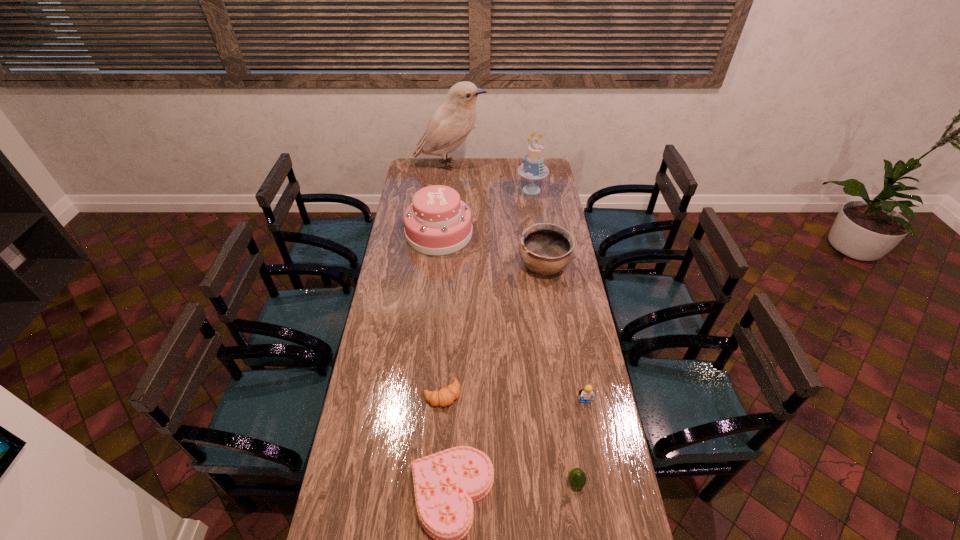
The width and height of the screenshot is (960, 540). What are the coordinates of `cake that is at the right edge` in the screenshot? It's located at (533, 168).

Find the location of a particular element. Image resolution: width=960 pixels, height=540 pixels. pottery that is at the right edge is located at coordinates (545, 249).

Identify the location of Lego present at the right edge. This screenshot has width=960, height=540. (587, 393).

Where is `avocado that is at the right edge`? avocado that is at the right edge is located at coordinates (577, 478).

Image resolution: width=960 pixels, height=540 pixels. Identify the location of object that is at the far left corner. (450, 124).

The width and height of the screenshot is (960, 540). In the image, there is a desktop. Identify the location of vacant space at the left edge. (412, 195).

At what (x,y) coordinates should I click in order to perform the action: click on free space at the right edge. Please return your answer as a coordinate pair (x, y). The height and width of the screenshot is (540, 960). Looking at the image, I should click on (570, 429).

Locate an element on the screen. free space between the parakeet and the shortest object is located at coordinates (445, 280).

What are the coordinates of `blank region between the Lego and the pottery` in the screenshot? It's located at (564, 334).

The height and width of the screenshot is (540, 960). In order to click on free space between the parakeet and the shortest object in this screenshot , I will do `click(445, 280)`.